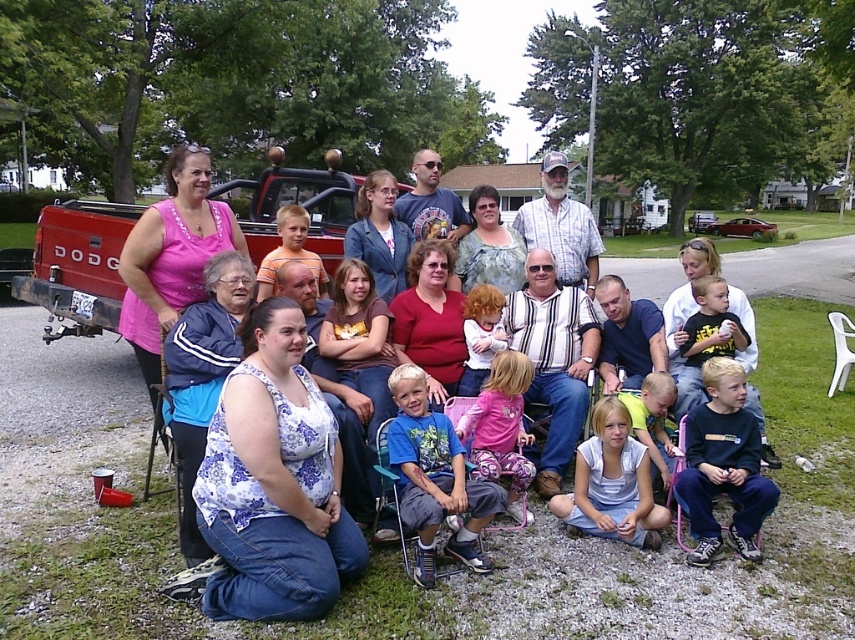
Question: Can you confirm if red matte truck at upper left is positioned to the left of matte red shirt at center?

Choices:
 (A) no
 (B) yes

Answer: (B)

Question: Which of the following is the closest to the observer?

Choices:
 (A) (478, 362)
 (B) (414, 195)

Answer: (A)

Question: Estimate the real-world distances between objects in this image. Which object is closer to the pink fabric dress at center?

Choices:
 (A) blue fabric jacket at center
 (B) white cotton shirt at center

Answer: (A)

Question: Does striped cotton shirt at center have a smaller size compared to matte red shirt at center?

Choices:
 (A) no
 (B) yes

Answer: (A)

Question: Which of the following is the farthest from the observer?

Choices:
 (A) floral fabric dress at center
 (B) plaid shirt at center

Answer: (B)

Question: Is striped cotton shirt at center positioned in front of light blue cotton dress at lower center?

Choices:
 (A) yes
 (B) no

Answer: (B)